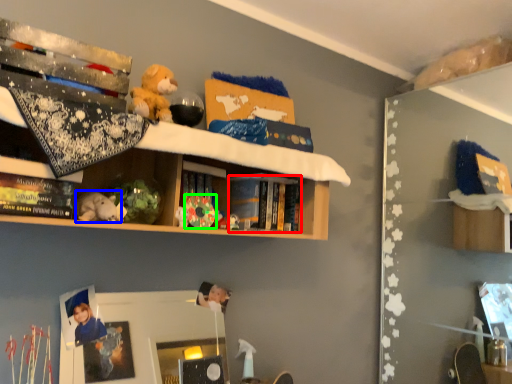
Question: Considering the real-world distances, which object is farthest from book (highlighted by a red box)? toy (highlighted by a blue box) or toy (highlighted by a green box)?

Choices:
 (A) toy
 (B) toy

Answer: (A)